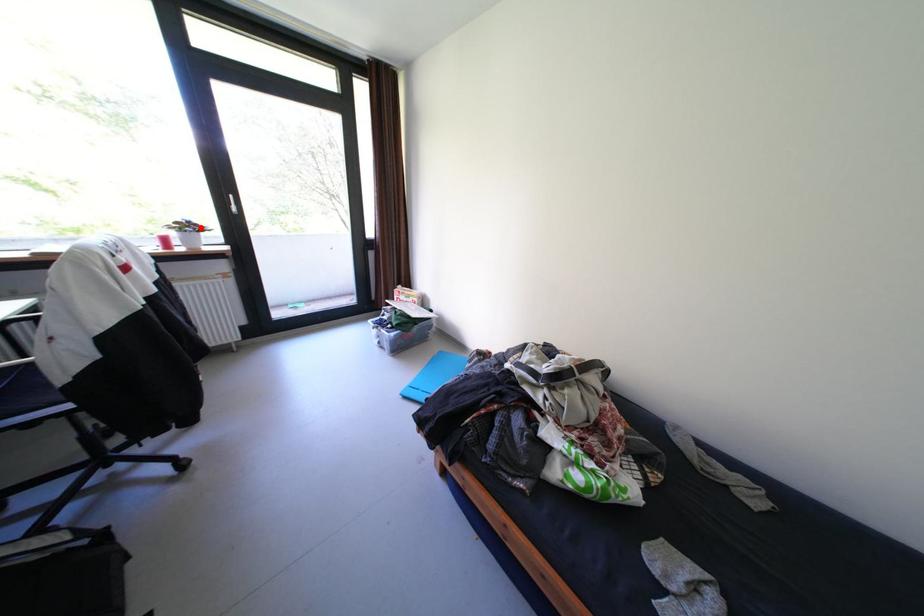
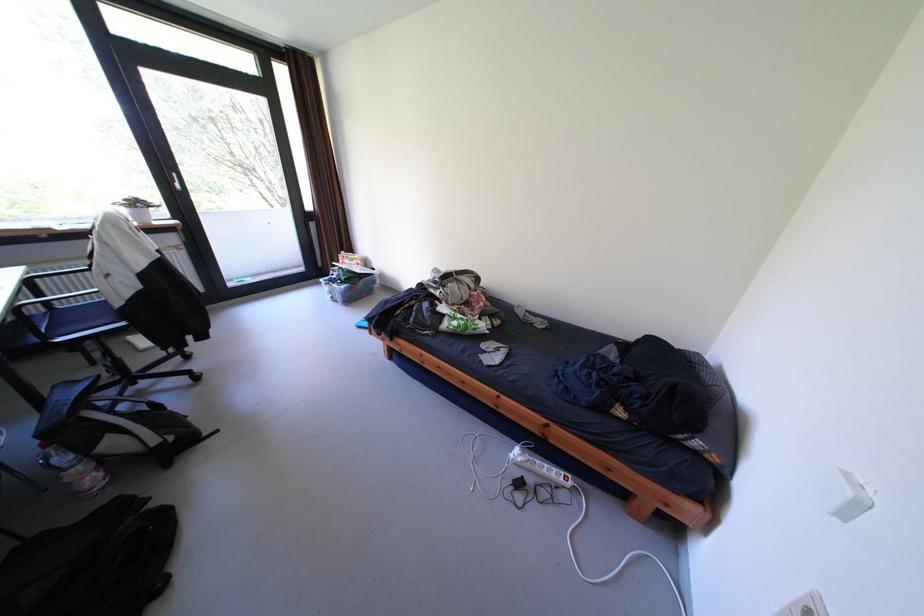
The point at the highlighted location is marked in the first image. Where is the corresponding point in the second image?

(149, 205)